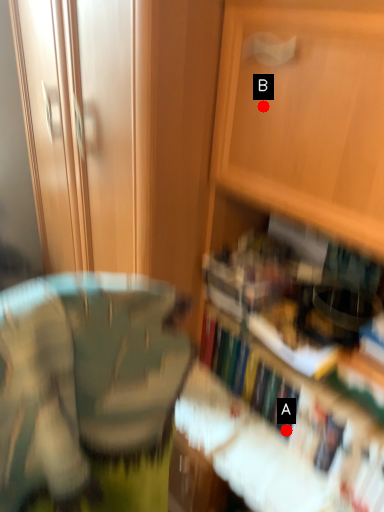
Question: Two points are circled on the image, labeled by A and B beside each circle. Which point appears farthest from the camera in this image?

Choices:
 (A) A is further
 (B) B is further

Answer: (A)